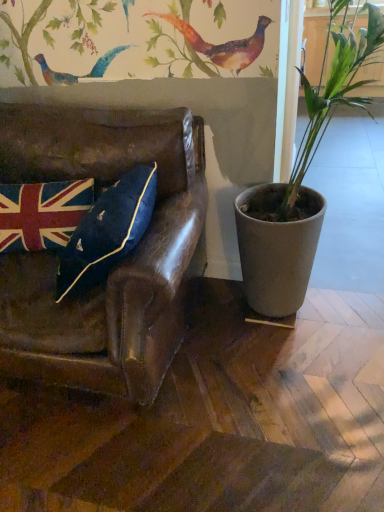
You are a GUI agent. You are given a task and a screenshot of the screen. Output one action in this format:
    pyautogui.click(x=<x>, y=<y>)
    Task: Click on the matte gray pot at right
    
    Given the screenshot: What is the action you would take?
    pyautogui.click(x=300, y=182)

Can you tell me how much matte gray pot at right and velvet union jack pillow at left differ in facing direction?

The angle between the facing direction of matte gray pot at right and the facing direction of velvet union jack pillow at left is 8.27 degrees.

How much distance is there between matte gray pot at right and velvet union jack pillow at left?

A distance of 31.48 inches exists between matte gray pot at right and velvet union jack pillow at left.

Who is taller, matte gray pot at right or velvet union jack pillow at left?

Standing taller between the two is matte gray pot at right.

Which is in front, point (270, 196) or point (77, 180)?

The point (77, 180) is closer to the camera.

From their relative heights in the image, would you say leather couch at left is taller or shorter than velvet union jack pillow at left?

Considering their sizes, leather couch at left has more height than velvet union jack pillow at left.

Can we say leather couch at left lies outside velvet union jack pillow at left?

Indeed, leather couch at left is completely outside velvet union jack pillow at left.

From a real-world perspective, is leather couch at left on top of velvet union jack pillow at left?

No, from a real-world perspective, leather couch at left is not above velvet union jack pillow at left.

Considering the sizes of objects leather couch at left and velvet union jack pillow at left in the image provided, who is bigger, leather couch at left or velvet union jack pillow at left?

Bigger between the two is leather couch at left.

From the image's perspective, between leather couch at left and matte gray pot at right, who is located below?

leather couch at left appears lower in the image.

Which is correct: leather couch at left is inside matte gray pot at right, or outside of it?

leather couch at left is located beyond the bounds of matte gray pot at right.

Is leather couch at left oriented towards matte gray pot at right?

No, leather couch at left is not turned towards matte gray pot at right.

Is leather couch at left far from matte gray pot at right?

No, leather couch at left is in close proximity to matte gray pot at right.

Considering the positions of point (41, 191) and point (316, 204), is point (41, 191) closer or farther from the camera than point (316, 204)?

Point (41, 191) is positioned closer to the camera compared to point (316, 204).

Is velvet union jack pillow at left at the left side of matte gray pot at right?

Yes, velvet union jack pillow at left is to the left of matte gray pot at right.

From a real-world perspective, which is physically below, velvet union jack pillow at left or matte gray pot at right?

velvet union jack pillow at left is physically lower.

From the picture: Is matte gray pot at right closer to camera compared to leather couch at left?

No, matte gray pot at right is further to the viewer.

The height and width of the screenshot is (512, 384). What are the coordinates of `houseplant lying behind the leather couch at left` in the screenshot? It's located at (300, 182).

Is matte gray pot at right placed right next to leather couch at left?

No.

How different are the orientations of matte gray pot at right and leather couch at left in degrees?

5.5 degrees separate the facing orientations of matte gray pot at right and leather couch at left.

In the scene shown: Which point is more distant from viewer, (1, 206) or (154, 275)?

The point (1, 206) is farther.

From the picture: Would you consider velvet union jack pillow at left to be distant from leather couch at left?

They are positioned close to each other.

Considering the relative sizes of velvet union jack pillow at left and leather couch at left in the image provided, is velvet union jack pillow at left bigger than leather couch at left?

Incorrect, velvet union jack pillow at left is not larger than leather couch at left.

Considering the relative positions of velvet union jack pillow at left and leather couch at left in the image provided, is velvet union jack pillow at left to the left or to the right of leather couch at left?

Clearly, velvet union jack pillow at left is on the left of leather couch at left in the image.

Image resolution: width=384 pixels, height=512 pixels. Identify the location of flag located below the matte gray pot at right (from the image's perspective). (42, 214).

This screenshot has height=512, width=384. Identify the location of flag that is above the leather couch at left (from the image's perspective). (42, 214).

When comparing their distances from leather couch at left, does matte gray pot at right or velvet union jack pillow at left seem closer?

velvet union jack pillow at left is closer to leather couch at left.

Looking at the image, which one is located closer to velvet union jack pillow at left, leather couch at left or matte gray pot at right?

leather couch at left is closer to velvet union jack pillow at left.

Considering their positions, is velvet union jack pillow at left positioned closer to leather couch at left than matte gray pot at right?

Among the two, velvet union jack pillow at left is located nearer to leather couch at left.

Considering their positions, is leather couch at left positioned further to matte gray pot at right than velvet union jack pillow at left?

Based on the image, velvet union jack pillow at left appears to be further to matte gray pot at right.

Based on their spatial positions, is velvet union jack pillow at left or leather couch at left further from matte gray pot at right?

Answer: The object further to matte gray pot at right is velvet union jack pillow at left.

Based on the photo, considering their positions, is matte gray pot at right positioned closer to velvet union jack pillow at left than leather couch at left?

leather couch at left.

What are the coordinates of `chair between velvet union jack pillow at left and matte gray pot at right in the horizontal direction` in the screenshot? It's located at (117, 266).